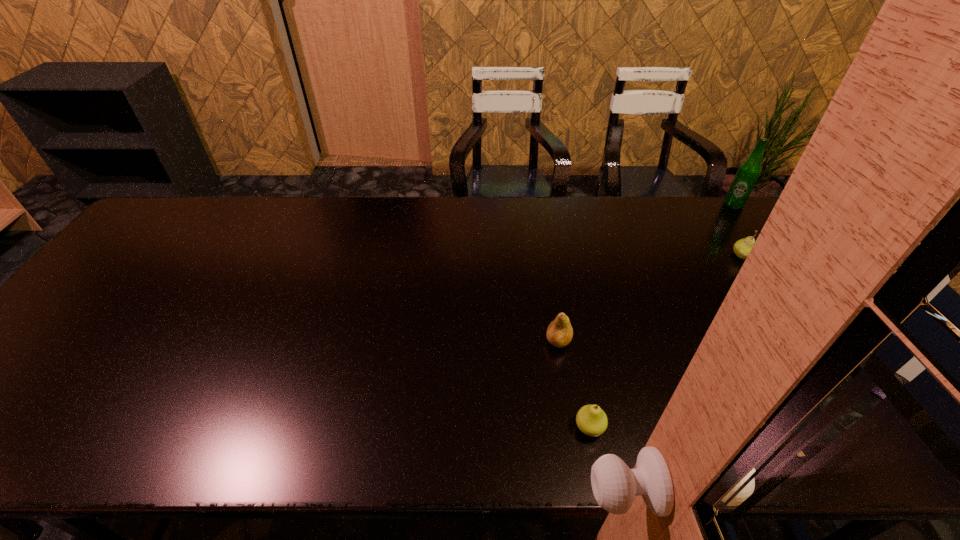
Find the location of a particular element. The image size is (960, 540). free space between the tallest object and the nearest object is located at coordinates (661, 316).

This screenshot has height=540, width=960. In order to click on free point between the farthest pear and the third farthest object in this screenshot , I will do `click(650, 298)`.

This screenshot has width=960, height=540. In order to click on free space between the rightmost pear and the farthest object in this screenshot , I will do `click(738, 230)`.

This screenshot has height=540, width=960. In order to click on free point between the nearest object and the second farthest pear in this screenshot , I will do `click(574, 384)`.

At what (x,y) coordinates should I click in order to perform the action: click on free space between the nearest object and the second object from right to left. Please return your answer as a coordinate pair (x, y). This screenshot has width=960, height=540. Looking at the image, I should click on (665, 342).

Locate an element on the screen. This screenshot has width=960, height=540. blank region between the farthest object and the second object from right to left is located at coordinates (738, 230).

Point out which object is positioned as the second nearest to the second farthest pear. Please provide its 2D coordinates. Your answer should be formatted as a tuple, i.e. [(x, y)], where the tuple contains the x and y coordinates of a point satisfying the conditions above.

[(742, 247)]

Locate which object is the second closest to the beer bottle. Please provide its 2D coordinates. Your answer should be formatted as a tuple, i.e. [(x, y)], where the tuple contains the x and y coordinates of a point satisfying the conditions above.

[(559, 333)]

Select which pear appears as the second closest to the beer bottle. Please provide its 2D coordinates. Your answer should be formatted as a tuple, i.e. [(x, y)], where the tuple contains the x and y coordinates of a point satisfying the conditions above.

[(559, 333)]

Identify the location of pear that stands as the second closest to the third nearest object. (591, 420).